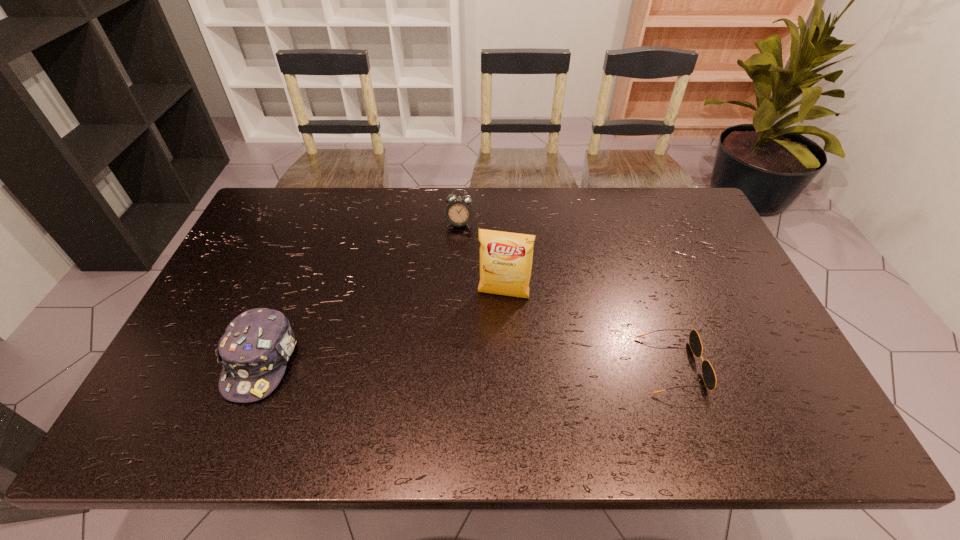
Find the location of a particular element. The height and width of the screenshot is (540, 960). vacant space located on the face of the third object from right to left is located at coordinates (444, 288).

What are the coordinates of `vacant space situated 0.250m on the front of the tallest object with the logo` in the screenshot? It's located at (484, 382).

The image size is (960, 540). In order to click on vacant region located 0.150m on the front of the tallest object with the logo in this screenshot , I will do `click(491, 348)`.

I want to click on free spot located on the front of the tallest object with the logo, so click(x=493, y=333).

This screenshot has width=960, height=540. What are the coordinates of `object present at the far edge` in the screenshot? It's located at (458, 212).

The width and height of the screenshot is (960, 540). I want to click on headwear that is at the near edge, so click(x=254, y=350).

Locate an element on the screen. This screenshot has width=960, height=540. sunglasses present at the near edge is located at coordinates (708, 374).

Find the location of a particular element. Image resolution: width=960 pixels, height=540 pixels. object located in the left edge section of the desktop is located at coordinates (254, 350).

Where is `object present at the near left corner`? This screenshot has height=540, width=960. object present at the near left corner is located at coordinates tap(254, 350).

Locate an element on the screen. vacant space at the far edge of the desktop is located at coordinates (616, 213).